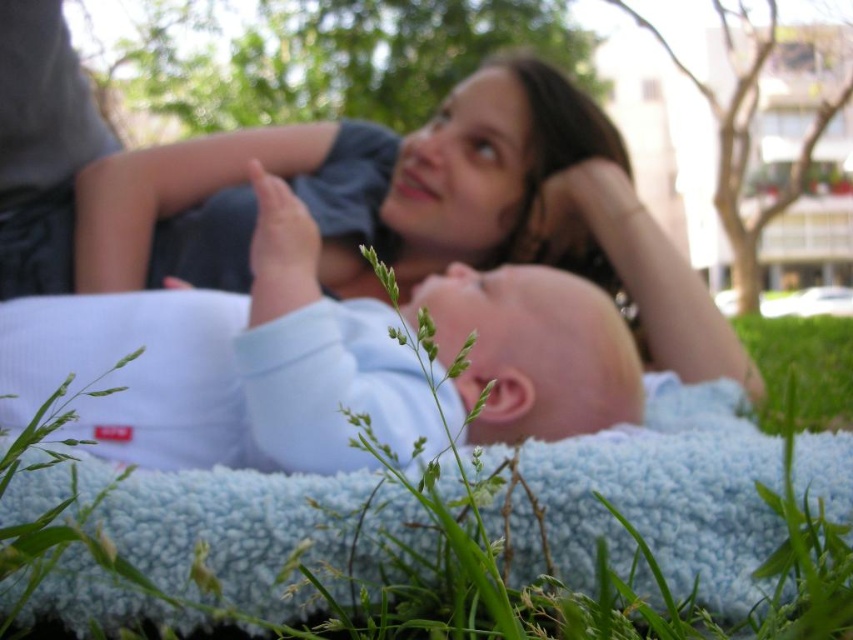
You are a photographer trying to capture the baby and the woman in the scene. The light blue fabric at center is where the baby is lying. To ensure the baby stays comfortable, you need to place a small pillow under its head. Where should you place the pillow relative to the point marked by the coordinate point (225,365)?

The light blue fabric at center is represented by point (225,365). Since the baby is lying on its back looking up, placing the pillow slightly above this point would support the baby comfortably without obstructing its view.

What is the location of the point with coordinates (225, 365) in the image?

The point with coordinates (225, 365) is located on the light blue fabric at center.